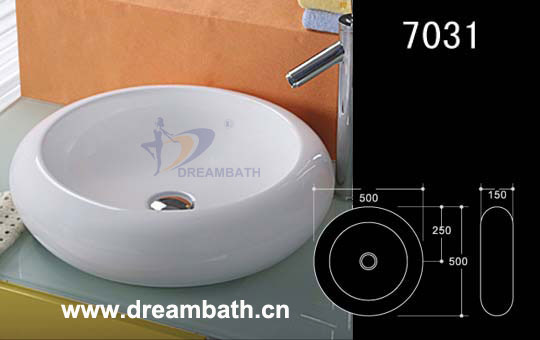
Locate an element on the screen. The image size is (540, 340). faucet base is located at coordinates (341, 117).